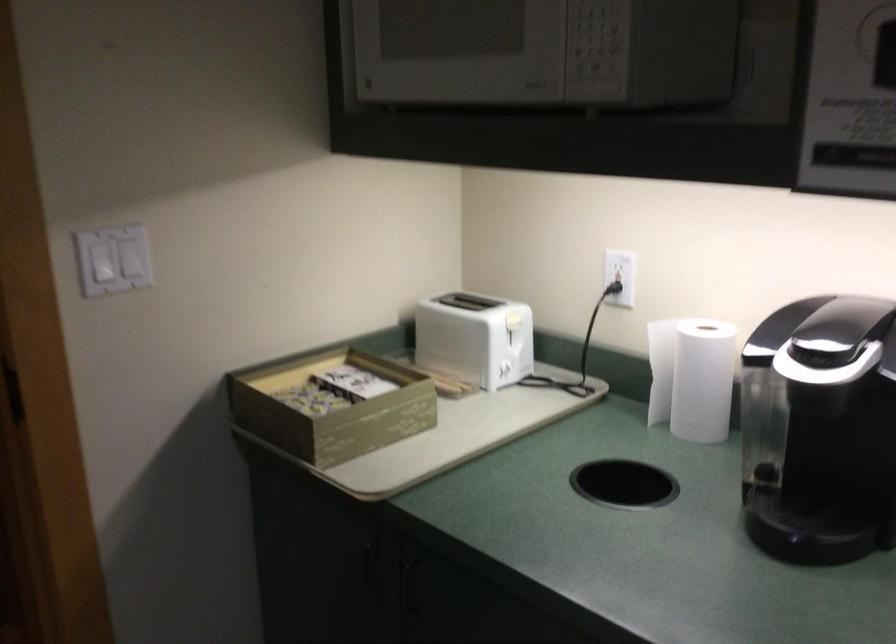
Identify the location of patterned green box. This screenshot has width=896, height=644. (330, 406).